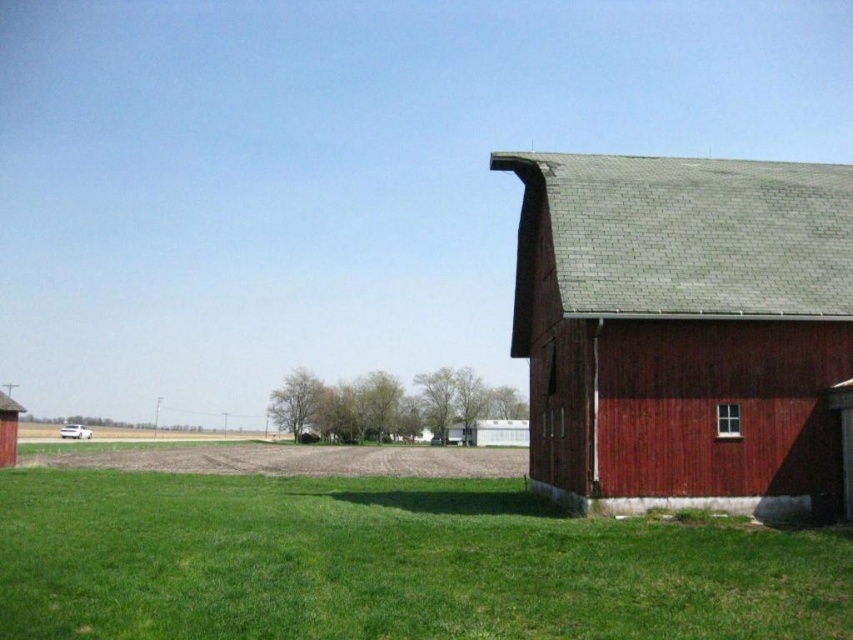
You are a farmer standing in the middle of the field looking towards the barns. Which barn is taller when comparing the smooth red barn at right and the rustic wood barn at lower left?

The smooth red barn at right is taller than the rustic wood barn at lower left.

You are standing at the origin point of the image, which is the bottom left corner. You want to walk to the green grass at lower right. According to the coordinates provided, in which direction should you move first?

The green grass at lower right is located at coordinates point [392,563]. Since you are at the origin point at the bottom left corner, you should first move to the right to increase the x coordinate from 0 to 0.881, then move up to reach the y coordinate of 0.460.

You are standing at the origin point of the image. Which direction should you walk to reach the green grass at lower right?

The green grass at lower right is located at point (392, 563), so you should walk towards the lower right direction to reach it.